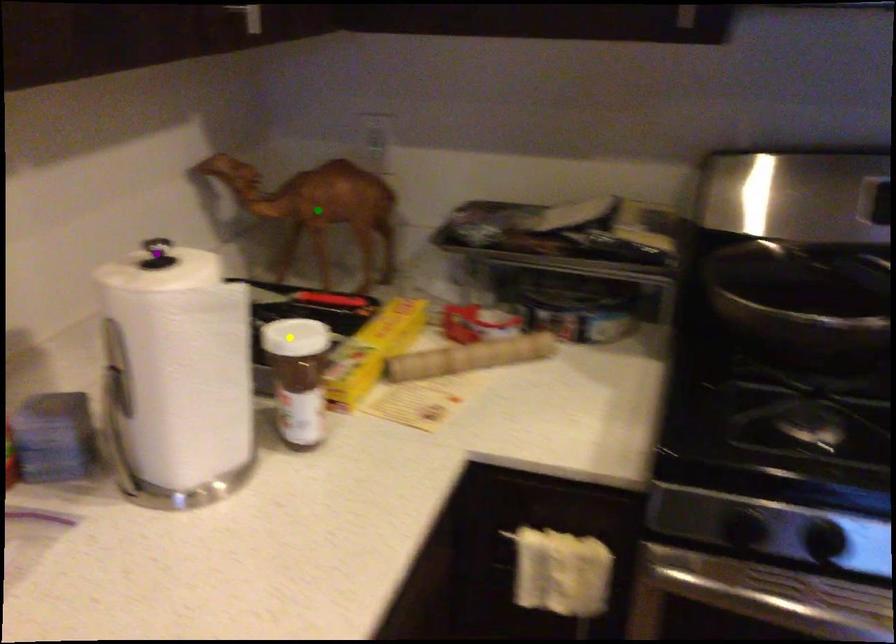
Order these from nearest to farthest:
A) purple point
B) green point
C) yellow point

purple point, yellow point, green point